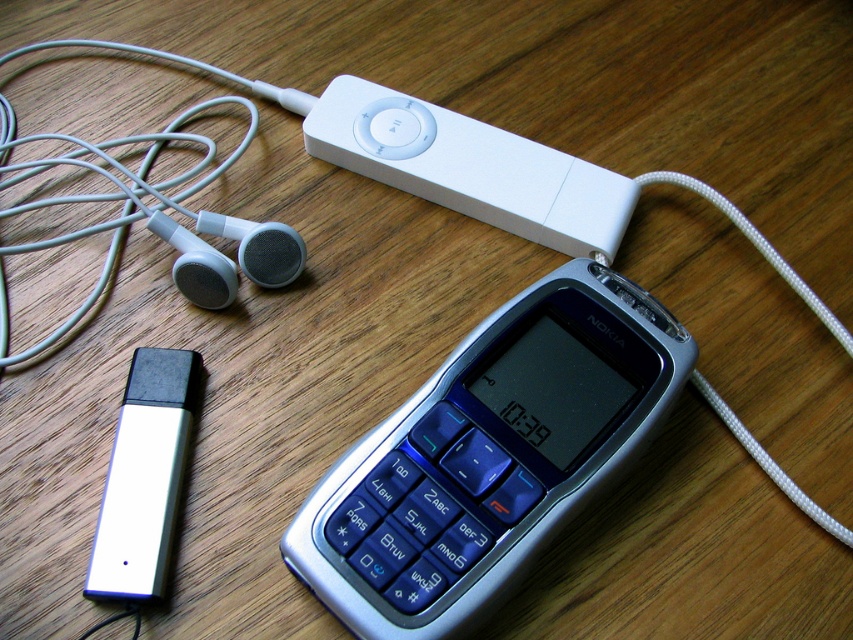
You are organizing a display of vintage electronics and need to stack the items vertically. Which item, the white matte ipod at upper left or the white matte earphone at upper left, should be placed at the bottom to ensure stability?

The white matte ipod at upper left should be placed at the bottom because it has a greater height than the white matte earphone at upper left, providing a more stable base.

You are organizing a display of vintage electronics. You have a silver metallic nokia phone at center and a satin black earphone at upper left. Which object takes up more space on the wooden surface?

The silver metallic nokia phone at center takes up more space on the wooden surface because it has a larger size compared to the satin black earphone at upper left.